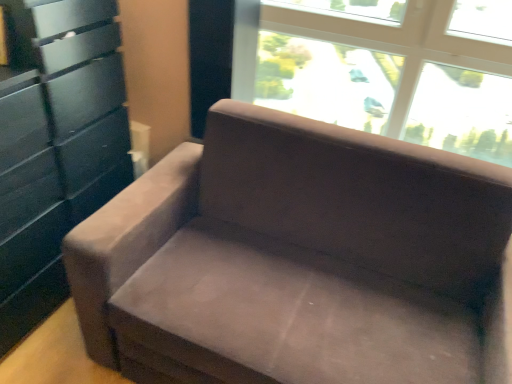
Question: Is suede couch at center facing away from transparent glass window at upper center?

Choices:
 (A) no
 (B) yes

Answer: (B)

Question: Is suede couch at center positioned in front of transparent glass window at upper center?

Choices:
 (A) no
 (B) yes

Answer: (B)

Question: Is suede couch at center positioned beyond the bounds of transparent glass window at upper center?

Choices:
 (A) yes
 (B) no

Answer: (A)

Question: Does suede couch at center touch transparent glass window at upper center?

Choices:
 (A) yes
 (B) no

Answer: (B)

Question: Can you confirm if suede couch at center is thinner than transparent glass window at upper center?

Choices:
 (A) no
 (B) yes

Answer: (A)

Question: Does suede couch at center have a larger size compared to transparent glass window at upper center?

Choices:
 (A) yes
 (B) no

Answer: (A)

Question: Would you say matte black dresser at left contains suede couch at center?

Choices:
 (A) yes
 (B) no

Answer: (B)

Question: Is matte black dresser at left wider than suede couch at center?

Choices:
 (A) yes
 (B) no

Answer: (B)

Question: Is the position of matte black dresser at left more distant than that of suede couch at center?

Choices:
 (A) yes
 (B) no

Answer: (A)

Question: Could you tell me if matte black dresser at left is facing suede couch at center?

Choices:
 (A) yes
 (B) no

Answer: (A)

Question: Is matte black dresser at left looking in the opposite direction of suede couch at center?

Choices:
 (A) yes
 (B) no

Answer: (B)

Question: Is matte black dresser at left at the left side of suede couch at center?

Choices:
 (A) yes
 (B) no

Answer: (A)

Question: From the image's perspective, would you say transparent glass window at upper center is shown under matte black dresser at left?

Choices:
 (A) no
 (B) yes

Answer: (A)